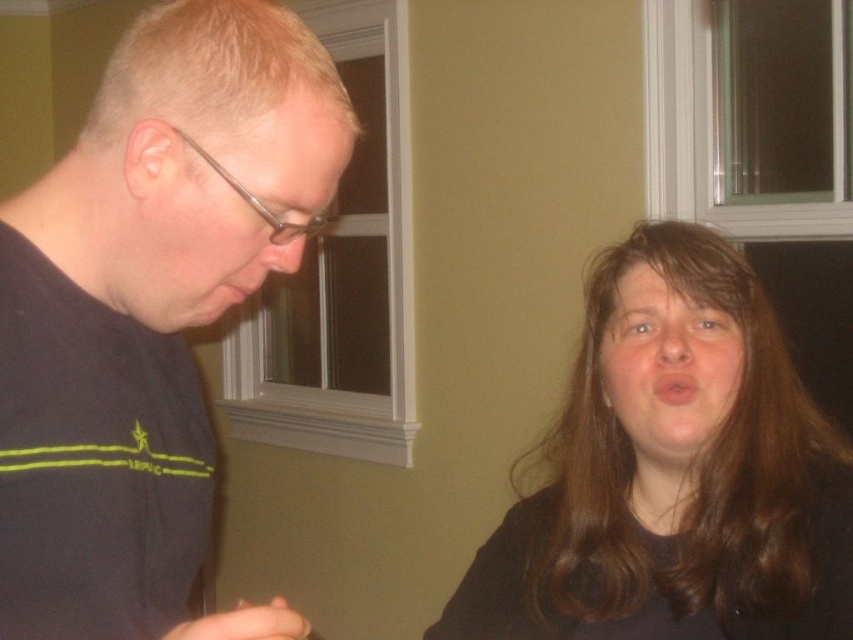
Question: Is black matte shirt at left below matte black face at center?

Choices:
 (A) yes
 (B) no

Answer: (B)

Question: Which of the following is the closest to the observer?

Choices:
 (A) dark brown hair at upper right
 (B) matte black glasses at left

Answer: (B)

Question: Which point is farther from the camera taking this photo?

Choices:
 (A) (839, 579)
 (B) (109, 132)
 (C) (312, 168)

Answer: (A)

Question: Which of the following is the farthest from the observer?

Choices:
 (A) matte black face at center
 (B) dark brown hair at upper right

Answer: (A)

Question: Can you confirm if dark brown hair at upper right is wider than matte black face at center?

Choices:
 (A) yes
 (B) no

Answer: (A)

Question: Observing the image, what is the correct spatial positioning of dark brown hair at upper right in reference to black matte shirt at left?

Choices:
 (A) right
 (B) left

Answer: (A)